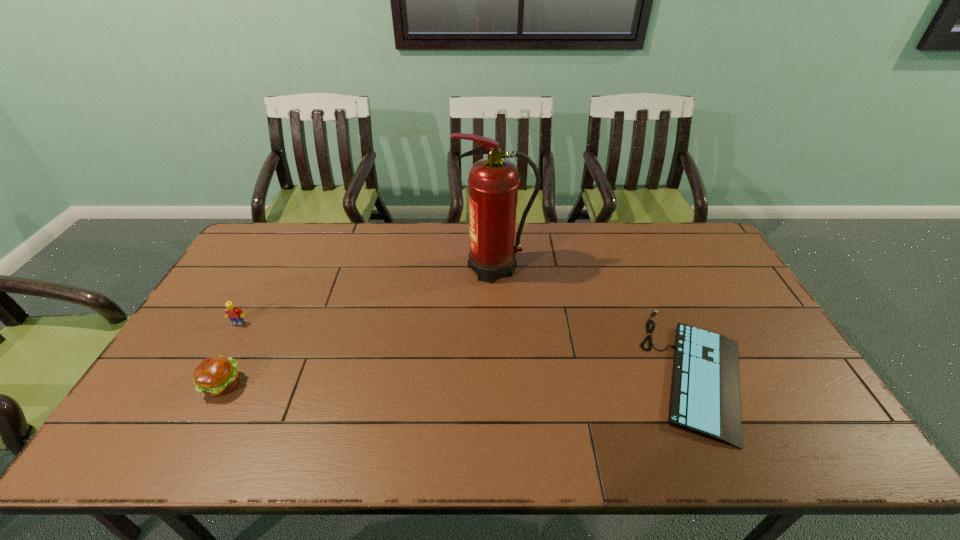
At what (x,y) coordinates should I click in order to perform the action: click on free location that satisfies the following two spatial constraints: 1. on the front-facing side of the tallest object; 2. on the front side of the hamburger. Please return your answer as a coordinate pair (x, y). Looking at the image, I should click on (499, 384).

Locate an element on the screen. free space that satisfies the following two spatial constraints: 1. on the front-facing side of the rightmost object; 2. on the right side of the Lego is located at coordinates (212, 370).